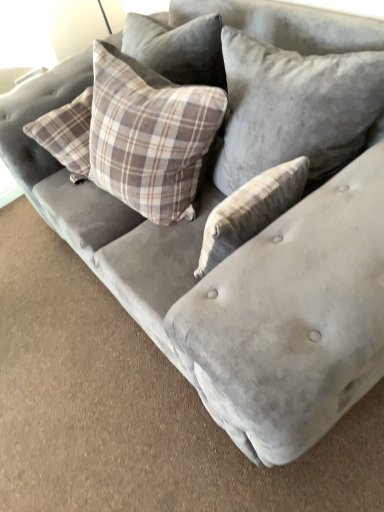
The width and height of the screenshot is (384, 512). What do you see at coordinates (293, 106) in the screenshot? I see `plaid fabric pillow at upper center` at bounding box center [293, 106].

You are a GUI agent. You are given a task and a screenshot of the screen. Output one action in this format:
    pyautogui.click(x=<x>, y=<y>)
    Task: Click on the plaid fabric pillow at upper center
    
    Given the screenshot: What is the action you would take?
    pyautogui.click(x=293, y=106)

In order to click on plaid fabric pillow at upper center in this screenshot , I will do `click(293, 106)`.